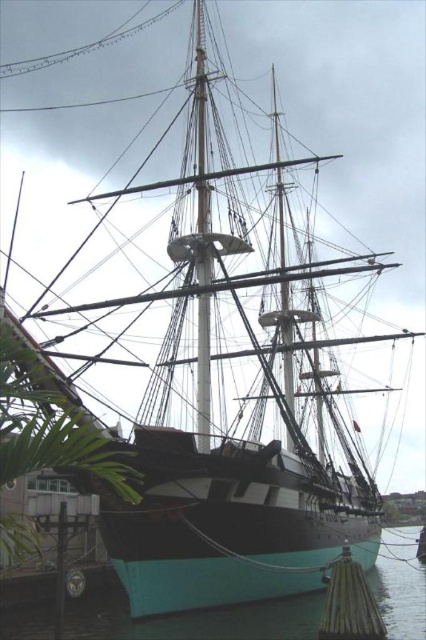
Is the position of teal glossy water at lower center more distant than that of green bamboo dock at lower right?

No, teal glossy water at lower center is closer to the viewer.

Can you confirm if teal glossy water at lower center is positioned to the right of green bamboo dock at lower right?

In fact, teal glossy water at lower center is to the left of green bamboo dock at lower right.

The width and height of the screenshot is (426, 640). In order to click on teal glossy water at lower center in this screenshot , I will do `click(195, 620)`.

The width and height of the screenshot is (426, 640). Identify the location of teal glossy water at lower center. (195, 620).